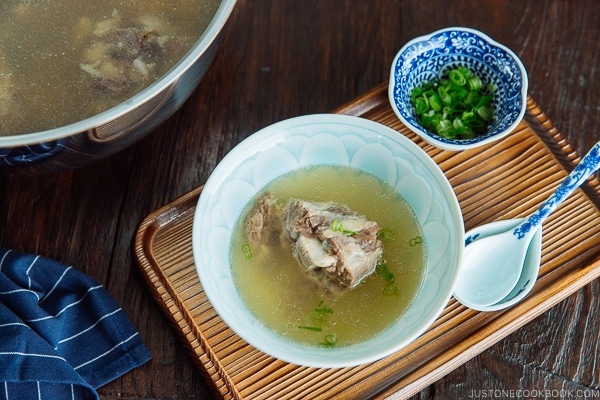
At what (x,y) coordinates should I click in order to perform the action: click on blue with thin white stripes kitchen towel. Please return your answer as a coordinate pair (x, y). Looking at the image, I should click on click(x=75, y=323).